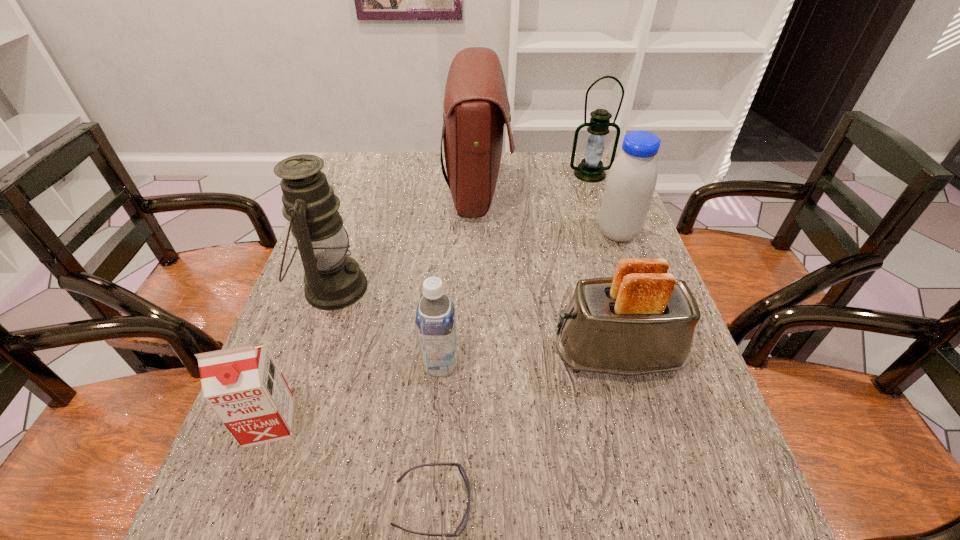
The width and height of the screenshot is (960, 540). I want to click on oil lamp that is at the left edge, so click(333, 280).

At what (x,y) coordinates should I click in order to perform the action: click on soya milk present at the left edge. Please return your answer as a coordinate pair (x, y). Looking at the image, I should click on (244, 386).

Image resolution: width=960 pixels, height=540 pixels. I want to click on lantern that is at the right edge, so click(x=591, y=169).

Locate an element on the screen. The width and height of the screenshot is (960, 540). soya milk positioned at the right edge is located at coordinates (631, 181).

Where is `toaster that is at the right edge`? This screenshot has width=960, height=540. toaster that is at the right edge is located at coordinates (641, 321).

The image size is (960, 540). I want to click on object that is at the far right corner, so click(x=591, y=169).

Identify the location of free space at the far edge of the desktop. This screenshot has width=960, height=540. (503, 184).

Where is `free space at the left edge of the desktop`? The image size is (960, 540). free space at the left edge of the desktop is located at coordinates point(293,498).

In the image, there is a desktop. What are the coordinates of `vacant space at the right edge` in the screenshot? It's located at (741, 506).

Identify the location of vacant space at the far left corner. (379, 165).